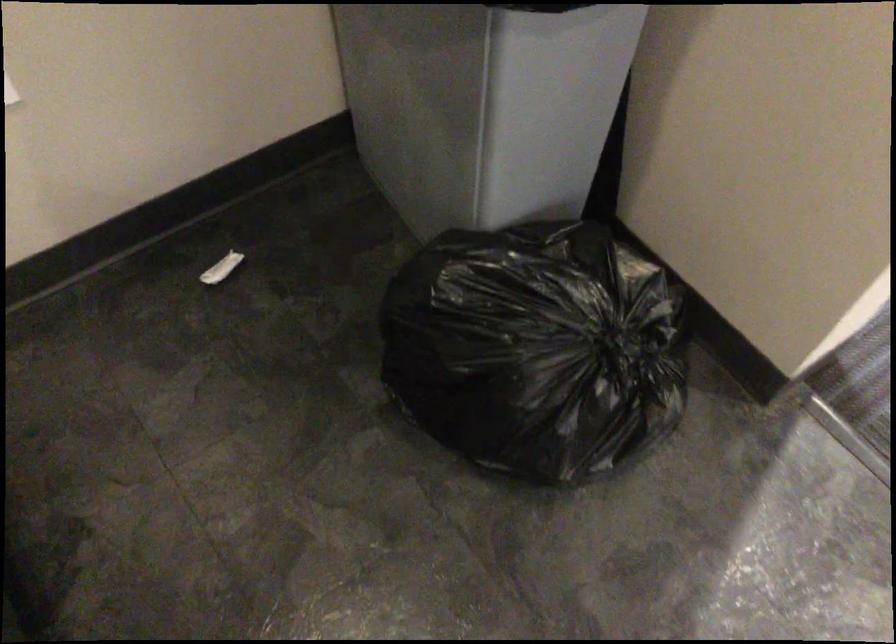
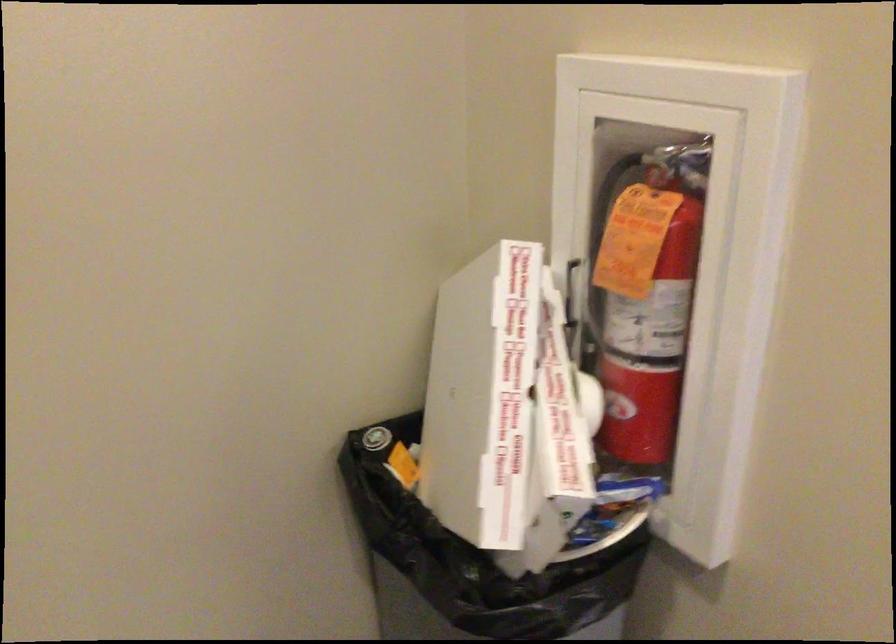
Question: The first image is from the beginning of the video and the second image is from the end. How did the camera likely rotate when shooting the video?

Choices:
 (A) Left
 (B) Right
 (C) Up
 (D) Down

Answer: (C)